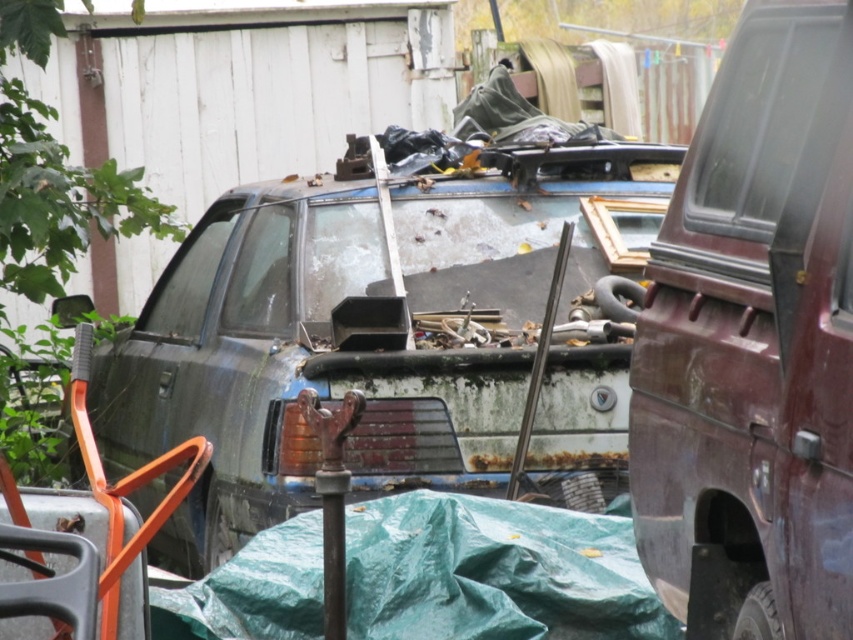
You are trying to determine if the rusty metal car at center and the rusty metal pickup at right can both fit through a narrow gate that requires vehicles to be under 2 meters in height. Based on their heights, which one might have difficulty passing through?

The rusty metal car at center is much taller than the rusty metal pickup at right, so the rusty metal car at center might have difficulty passing through the gate if it exceeds the 2 meters height limit.

You are a delivery person who needs to park a 2.0 meter wide delivery truck between the rusty metal car at center and the rusty metal pickup at right. Is there enough space between them for the truck?

The rusty metal car at center is 2.16 meters from the rusty metal pickup at right. Since the truck is 2.0 meters wide, there is enough space between them for the truck to fit.